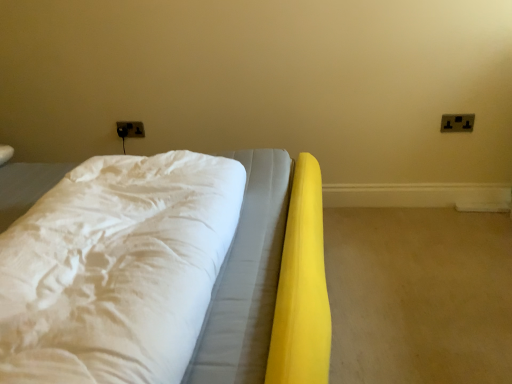
This screenshot has width=512, height=384. Describe the element at coordinates (130, 129) in the screenshot. I see `black plastic electrical outlet at upper left, which is the first electric outlet in back-to-front order` at that location.

The width and height of the screenshot is (512, 384). Find the location of `black plastic electric outlet at upper right, placed as the first electric outlet when sorted from front to back`. black plastic electric outlet at upper right, placed as the first electric outlet when sorted from front to back is located at coordinates pos(457,123).

Find the location of a particular element. This screenshot has width=512, height=384. black plastic electrical outlet at upper left, arranged as the second electric outlet when viewed from the right is located at coordinates (130, 129).

Is black plastic electric outlet at upper right, placed as the first electric outlet when sorted from front to back, bigger than black plastic electrical outlet at upper left, which is the first electric outlet in back-to-front order?

No.

Which point is more distant from viewer, (x=461, y=116) or (x=138, y=133)?

The point (x=138, y=133) is farther.

Find the location of `electric outlet below the black plastic electrical outlet at upper left, arranged as the second electric outlet when viewed from the right (from the image's perspective)`. electric outlet below the black plastic electrical outlet at upper left, arranged as the second electric outlet when viewed from the right (from the image's perspective) is located at coordinates [457, 123].

Can you confirm if black plastic electric outlet at upper right, arranged as the 2th electric outlet when viewed from the back, is wider than black plastic electrical outlet at upper left, acting as the second electric outlet starting from the front?

No.

From a real-world perspective, which object rests below the other?

black plastic electric outlet at upper right, placed as the first electric outlet when sorted from front to back.

Measure the distance from white fabric bed at center to black plastic electric outlet at upper right, placed as the 2th electric outlet when sorted from left to right.

white fabric bed at center is 1.20 meters from black plastic electric outlet at upper right, placed as the 2th electric outlet when sorted from left to right.

Is white fabric bed at center looking in the opposite direction of black plastic electric outlet at upper right, arranged as the 2th electric outlet when viewed from the back?

white fabric bed at center does not have its back to black plastic electric outlet at upper right, arranged as the 2th electric outlet when viewed from the back.

Is the depth of white fabric bed at center less than that of black plastic electric outlet at upper right, marked as the 1th electric outlet in a right-to-left arrangement?

Yes, it is in front of black plastic electric outlet at upper right, marked as the 1th electric outlet in a right-to-left arrangement.

Choose the correct answer: Is black plastic electrical outlet at upper left, which is counted as the first electric outlet, starting from the left, inside white fabric bed at center or outside it?

black plastic electrical outlet at upper left, which is counted as the first electric outlet, starting from the left, is spatially situated outside white fabric bed at center.

Could you measure the distance between black plastic electrical outlet at upper left, which is the first electric outlet in back-to-front order, and white fabric bed at center?

black plastic electrical outlet at upper left, which is the first electric outlet in back-to-front order, and white fabric bed at center are 3.86 feet apart.

Consider the image. From the image's perspective, is black plastic electrical outlet at upper left, which is the first electric outlet in back-to-front order, located above or below white fabric bed at center?

From the image's perspective, black plastic electrical outlet at upper left, which is the first electric outlet in back-to-front order, appears above white fabric bed at center.

From a real-world perspective, which object stands above the other?

In real-world perspective, white fabric bed at center is above.

Is white fabric bed at center thinner than black plastic electrical outlet at upper left, arranged as the second electric outlet when viewed from the right?

No, white fabric bed at center is not thinner than black plastic electrical outlet at upper left, arranged as the second electric outlet when viewed from the right.

Based on the photo, considering the positions of objects white fabric bed at center and black plastic electrical outlet at upper left, which is the first electric outlet in back-to-front order, in the image provided, who is more to the right, white fabric bed at center or black plastic electrical outlet at upper left, which is the first electric outlet in back-to-front order,?

white fabric bed at center.

Which is correct: white fabric bed at center is inside black plastic electrical outlet at upper left, arranged as the second electric outlet when viewed from the right, or outside of it?

white fabric bed at center exists outside the volume of black plastic electrical outlet at upper left, arranged as the second electric outlet when viewed from the right.

Is black plastic electric outlet at upper right, placed as the first electric outlet when sorted from front to back, at the left side of white fabric bed at center?

No.

In the scene shown: Which of these two, black plastic electric outlet at upper right, arranged as the 2th electric outlet when viewed from the back, or white fabric bed at center, stands shorter?

black plastic electric outlet at upper right, arranged as the 2th electric outlet when viewed from the back.

Does black plastic electric outlet at upper right, placed as the 2th electric outlet when sorted from left to right, have a greater width compared to white fabric bed at center?

No, black plastic electric outlet at upper right, placed as the 2th electric outlet when sorted from left to right, is not wider than white fabric bed at center.

From the image's perspective, would you say black plastic electric outlet at upper right, placed as the first electric outlet when sorted from front to back, is positioned over white fabric bed at center?

Indeed, from the image's perspective, black plastic electric outlet at upper right, placed as the first electric outlet when sorted from front to back, is shown above white fabric bed at center.

Are black plastic electrical outlet at upper left, which is the first electric outlet in back-to-front order, and black plastic electric outlet at upper right, marked as the 1th electric outlet in a right-to-left arrangement, beside each other?

No, black plastic electrical outlet at upper left, which is the first electric outlet in back-to-front order, is not touching black plastic electric outlet at upper right, marked as the 1th electric outlet in a right-to-left arrangement.

From the picture: Can you confirm if black plastic electrical outlet at upper left, which is the first electric outlet in back-to-front order, is thinner than black plastic electric outlet at upper right, marked as the 1th electric outlet in a right-to-left arrangement?

Incorrect, the width of black plastic electrical outlet at upper left, which is the first electric outlet in back-to-front order, is not less than that of black plastic electric outlet at upper right, marked as the 1th electric outlet in a right-to-left arrangement.

Which is more to the right, black plastic electrical outlet at upper left, which is counted as the first electric outlet, starting from the left, or black plastic electric outlet at upper right, arranged as the 2th electric outlet when viewed from the back?

black plastic electric outlet at upper right, arranged as the 2th electric outlet when viewed from the back.

Identify the location of electric outlet behind the black plastic electric outlet at upper right, placed as the first electric outlet when sorted from front to back. This screenshot has height=384, width=512. pyautogui.click(x=130, y=129).

This screenshot has width=512, height=384. I want to click on electric outlet that appears on the right of white fabric bed at center, so click(457, 123).

Based on their spatial positions, is white fabric bed at center or black plastic electrical outlet at upper left, acting as the second electric outlet starting from the front, closer to black plastic electric outlet at upper right, placed as the 2th electric outlet when sorted from left to right?

The object closer to black plastic electric outlet at upper right, placed as the 2th electric outlet when sorted from left to right, is white fabric bed at center.

Estimate the real-world distances between objects in this image. Which object is closer to black plastic electrical outlet at upper left, which is the first electric outlet in back-to-front order, white fabric bed at center or black plastic electric outlet at upper right, arranged as the 2th electric outlet when viewed from the back?

The object closer to black plastic electrical outlet at upper left, which is the first electric outlet in back-to-front order, is white fabric bed at center.

Based on their spatial positions, is black plastic electrical outlet at upper left, arranged as the second electric outlet when viewed from the right, or white fabric bed at center further from black plastic electric outlet at upper right, marked as the 1th electric outlet in a right-to-left arrangement?

black plastic electrical outlet at upper left, arranged as the second electric outlet when viewed from the right, lies further to black plastic electric outlet at upper right, marked as the 1th electric outlet in a right-to-left arrangement, than the other object.

Estimate the real-world distances between objects in this image. Which object is closer to black plastic electrical outlet at upper left, which is the first electric outlet in back-to-front order, black plastic electric outlet at upper right, placed as the 2th electric outlet when sorted from left to right, or white fabric bed at center?

The object closer to black plastic electrical outlet at upper left, which is the first electric outlet in back-to-front order, is white fabric bed at center.

When comparing their distances from white fabric bed at center, does black plastic electric outlet at upper right, placed as the first electric outlet when sorted from front to back, or black plastic electrical outlet at upper left, arranged as the second electric outlet when viewed from the right, seem closer?

The object closer to white fabric bed at center is black plastic electrical outlet at upper left, arranged as the second electric outlet when viewed from the right.

When comparing their distances from white fabric bed at center, does black plastic electrical outlet at upper left, which is the first electric outlet in back-to-front order, or black plastic electric outlet at upper right, placed as the first electric outlet when sorted from front to back, seem further?

black plastic electric outlet at upper right, placed as the first electric outlet when sorted from front to back, is positioned further to the anchor white fabric bed at center.

Locate an element on the screen. This screenshot has height=384, width=512. electric outlet between white fabric bed at center and black plastic electrical outlet at upper left, arranged as the second electric outlet when viewed from the right, from front to back is located at coordinates (457, 123).